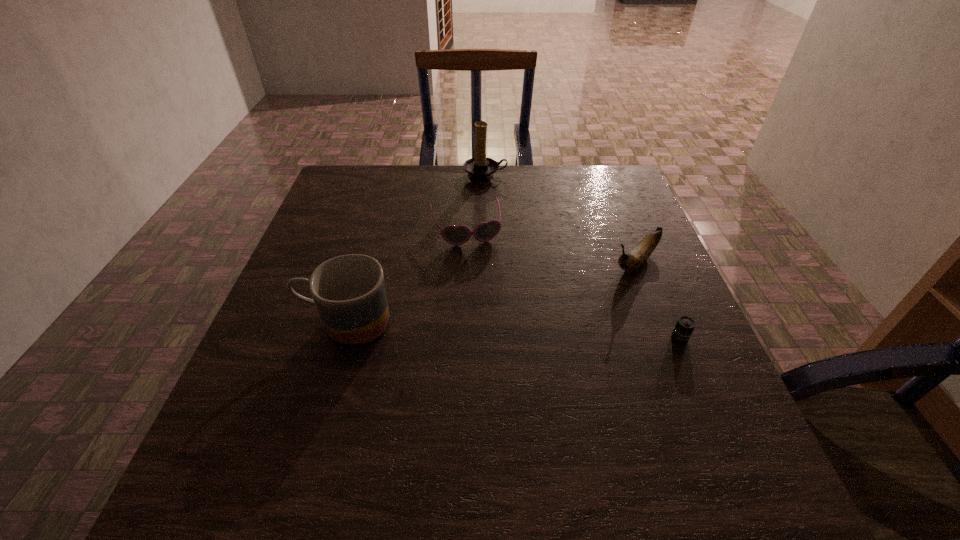
You are a GUI agent. You are given a task and a screenshot of the screen. Output one action in this format:
    pyautogui.click(x=<x>, y=<y>)
    Task: Click on the vacant space in between the fourth tallest object and the mug
    
    Given the screenshot: What is the action you would take?
    pyautogui.click(x=406, y=276)

Where is `free space between the farthest object and the beer can`? Image resolution: width=960 pixels, height=540 pixels. free space between the farthest object and the beer can is located at coordinates (583, 257).

I want to click on free space between the beer can and the farthest object, so click(x=583, y=257).

Where is `free space between the second shortest object and the farthest object`? The width and height of the screenshot is (960, 540). free space between the second shortest object and the farthest object is located at coordinates (475, 203).

The width and height of the screenshot is (960, 540). Find the location of `vacant space in between the mug and the fourth tallest object`. vacant space in between the mug and the fourth tallest object is located at coordinates (406, 276).

Where is `free spot between the third tallest object and the second tallest object`? This screenshot has width=960, height=540. free spot between the third tallest object and the second tallest object is located at coordinates (491, 292).

Where is `free space between the shortest object and the banana`? The width and height of the screenshot is (960, 540). free space between the shortest object and the banana is located at coordinates (657, 300).

Image resolution: width=960 pixels, height=540 pixels. What are the coordinates of `object that stands as the closest to the fourth tallest object` in the screenshot? It's located at (480, 168).

Locate an element on the screen. the closest object to the banana is located at coordinates (684, 327).

Where is `vacant space that satisfies the following two spatial constraints: 1. on the front side of the banana; 2. on the right side of the second shortest object`? The image size is (960, 540). vacant space that satisfies the following two spatial constraints: 1. on the front side of the banana; 2. on the right side of the second shortest object is located at coordinates (465, 262).